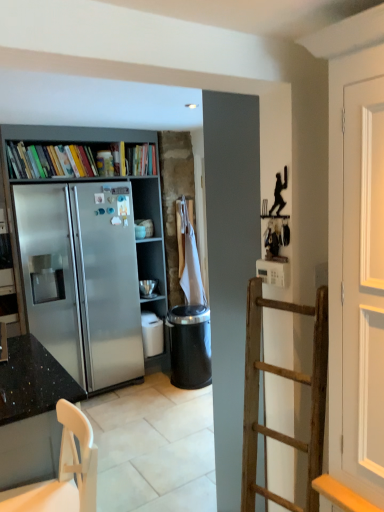
Question: From the image's perspective, is granite black countertop at left above white plastic chair at lower left?

Choices:
 (A) no
 (B) yes

Answer: (A)

Question: Is granite black countertop at left at the right side of white plastic chair at lower left?

Choices:
 (A) yes
 (B) no

Answer: (B)

Question: Considering the relative sizes of granite black countertop at left and white plastic chair at lower left in the image provided, is granite black countertop at left smaller than white plastic chair at lower left?

Choices:
 (A) yes
 (B) no

Answer: (B)

Question: Does granite black countertop at left have a larger size compared to white plastic chair at lower left?

Choices:
 (A) yes
 (B) no

Answer: (A)

Question: Is granite black countertop at left to the left of white plastic chair at lower left from the viewer's perspective?

Choices:
 (A) yes
 (B) no

Answer: (A)

Question: From the image's perspective, is granite black countertop at left below white plastic chair at lower left?

Choices:
 (A) yes
 (B) no

Answer: (A)

Question: From a real-world perspective, is white plastic chair at lower left positioned under multicolored paperbacks at upper left based on gravity?

Choices:
 (A) yes
 (B) no

Answer: (A)

Question: Can you confirm if white plastic chair at lower left is positioned to the left of multicolored paperbacks at upper left?

Choices:
 (A) no
 (B) yes

Answer: (A)

Question: Considering the relative sizes of white plastic chair at lower left and multicolored paperbacks at upper left in the image provided, is white plastic chair at lower left smaller than multicolored paperbacks at upper left?

Choices:
 (A) no
 (B) yes

Answer: (A)

Question: Is multicolored paperbacks at upper left at the back of white plastic chair at lower left?

Choices:
 (A) no
 (B) yes

Answer: (A)

Question: Can you confirm if white plastic chair at lower left is thinner than multicolored paperbacks at upper left?

Choices:
 (A) yes
 (B) no

Answer: (B)

Question: Considering the relative sizes of white plastic chair at lower left and multicolored paperbacks at upper left in the image provided, is white plastic chair at lower left shorter than multicolored paperbacks at upper left?

Choices:
 (A) yes
 (B) no

Answer: (B)

Question: Is satin silver bookcase at left to the left of black plastic trash can at center from the viewer's perspective?

Choices:
 (A) no
 (B) yes

Answer: (B)